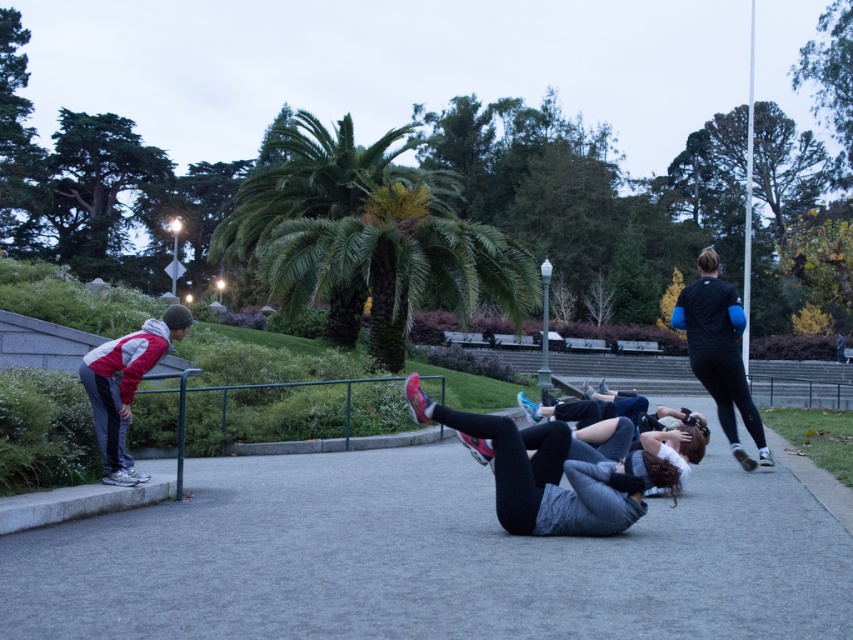
Question: Can you confirm if gray asphalt pavement at center is smaller than black matte jacket at upper right?

Choices:
 (A) no
 (B) yes

Answer: (A)

Question: Estimate the real-world distances between objects in this image. Which object is closer to the reddish-gray sneakers at left?

Choices:
 (A) gray fabric leggings at center
 (B) black matte jacket at upper right
 (C) gray asphalt pavement at center

Answer: (C)

Question: Can you confirm if gray asphalt pavement at center is wider than gray fabric leggings at center?

Choices:
 (A) no
 (B) yes

Answer: (B)

Question: Among these objects, which one is nearest to the camera?

Choices:
 (A) gray fabric leggings at center
 (B) black matte jacket at upper right
 (C) gray asphalt pavement at center
 (D) reddish-gray sneakers at left

Answer: (C)

Question: Observing the image, what is the correct spatial positioning of gray asphalt pavement at center in reference to black matte jacket at upper right?

Choices:
 (A) left
 (B) right

Answer: (A)

Question: Among these objects, which one is farthest from the camera?

Choices:
 (A) black matte jacket at upper right
 (B) reddish-gray sneakers at left
 (C) gray fabric leggings at center

Answer: (A)